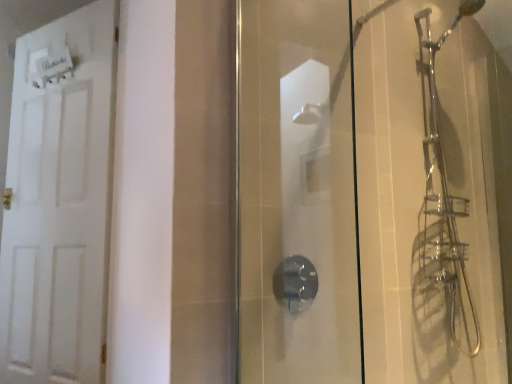
Question: Could you tell me if transparent glass shower door at center is turned towards white matte door at left?

Choices:
 (A) no
 (B) yes

Answer: (A)

Question: Considering the relative sizes of transparent glass shower door at center and white matte door at left in the image provided, is transparent glass shower door at center shorter than white matte door at left?

Choices:
 (A) no
 (B) yes

Answer: (B)

Question: Can we say transparent glass shower door at center lies outside white matte door at left?

Choices:
 (A) no
 (B) yes

Answer: (B)

Question: From a real-world perspective, is transparent glass shower door at center below white matte door at left?

Choices:
 (A) no
 (B) yes

Answer: (B)

Question: Is transparent glass shower door at center positioned in front of white matte door at left?

Choices:
 (A) yes
 (B) no

Answer: (A)

Question: Does transparent glass shower door at center have a larger size compared to white matte door at left?

Choices:
 (A) no
 (B) yes

Answer: (A)

Question: From a real-world perspective, is white matte door at left on top of transparent glass shower door at center?

Choices:
 (A) no
 (B) yes

Answer: (B)

Question: Is white matte door at left next to transparent glass shower door at center?

Choices:
 (A) no
 (B) yes

Answer: (A)

Question: Is white matte door at left not inside transparent glass shower door at center?

Choices:
 (A) yes
 (B) no

Answer: (A)

Question: Can you confirm if white matte door at left is thinner than transparent glass shower door at center?

Choices:
 (A) yes
 (B) no

Answer: (B)

Question: Is white matte door at left further to camera compared to transparent glass shower door at center?

Choices:
 (A) no
 (B) yes

Answer: (B)

Question: From the image's perspective, would you say white matte door at left is shown under transparent glass shower door at center?

Choices:
 (A) no
 (B) yes

Answer: (A)

Question: Considering the positions of white matte door at left and transparent glass shower door at center in the image, is white matte door at left wider or thinner than transparent glass shower door at center?

Choices:
 (A) thin
 (B) wide

Answer: (B)